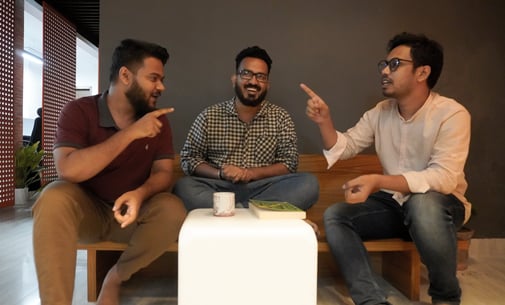
Find the location of `bench`. bench is located at coordinates (380, 245), (325, 172), (91, 266).